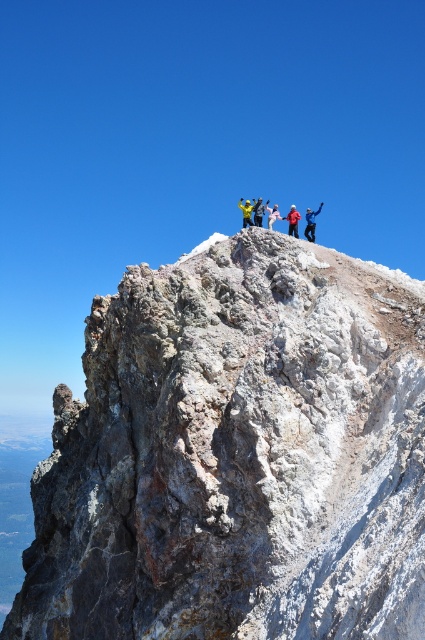
Question: Which point appears farthest from the camera in this image?

Choices:
 (A) (71, 618)
 (B) (248, 212)
 (C) (320, 205)
 (D) (294, 230)

Answer: (C)

Question: Which object appears farthest from the camera in this image?

Choices:
 (A) white snowboarder at center
 (B) yellow fabric at center

Answer: (B)

Question: Is white snowboarder at center closer to camera compared to yellow fabric at center?

Choices:
 (A) yes
 (B) no

Answer: (A)

Question: Which object is the farthest from the matte yellow jacket at center?

Choices:
 (A) white snowboarder at center
 (B) yellow fabric at center
 (C) rugged stone mountain at upper center
 (D) yellow fabric jacket at upper center

Answer: (B)

Question: Does white snowboarder at center appear on the left side of yellow fabric jacket at upper center?

Choices:
 (A) yes
 (B) no

Answer: (B)

Question: Can you confirm if white snowboarder at center is positioned to the right of matte yellow jacket at center?

Choices:
 (A) no
 (B) yes

Answer: (B)